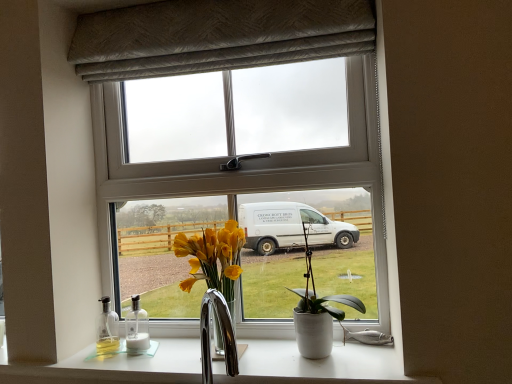
Question: Is white glossy bottle at lower left smaller than white plastic window at center?

Choices:
 (A) yes
 (B) no

Answer: (A)

Question: Can you see white glossy bottle at lower left touching white plastic window at center?

Choices:
 (A) yes
 (B) no

Answer: (B)

Question: Can we say white glossy bottle at lower left lies outside white plastic window at center?

Choices:
 (A) yes
 (B) no

Answer: (A)

Question: From a real-world perspective, is white glossy bottle at lower left on white plastic window at center?

Choices:
 (A) no
 (B) yes

Answer: (A)

Question: Is white glossy bottle at lower left facing away from white plastic window at center?

Choices:
 (A) no
 (B) yes

Answer: (B)

Question: Relative to textured gray curtain at upper center, is white ceramic pot at center in front or behind?

Choices:
 (A) front
 (B) behind

Answer: (A)

Question: Does point (296, 337) appear closer or farther from the camera than point (351, 8)?

Choices:
 (A) farther
 (B) closer

Answer: (A)

Question: Is white ceramic pot at center bigger or smaller than textured gray curtain at upper center?

Choices:
 (A) big
 (B) small

Answer: (B)

Question: In the image, is white ceramic pot at center on the left side or the right side of textured gray curtain at upper center?

Choices:
 (A) right
 (B) left

Answer: (A)

Question: From a real-world perspective, is white plastic window at center above or below white glossy bottle at lower left?

Choices:
 (A) above
 (B) below

Answer: (A)

Question: From the image's perspective, is white plastic window at center above or below white glossy bottle at lower left?

Choices:
 (A) above
 (B) below

Answer: (A)

Question: In the image, is white plastic window at center positioned in front of or behind white glossy bottle at lower left?

Choices:
 (A) behind
 (B) front

Answer: (B)

Question: In terms of size, does white plastic window at center appear bigger or smaller than white glossy bottle at lower left?

Choices:
 (A) big
 (B) small

Answer: (A)

Question: From the image's perspective, relative to white glossy countertop at lower center, is white ceramic pot at center above or below?

Choices:
 (A) above
 (B) below

Answer: (A)

Question: Is point (349, 299) positioned closer to the camera than point (174, 377)?

Choices:
 (A) farther
 (B) closer

Answer: (A)